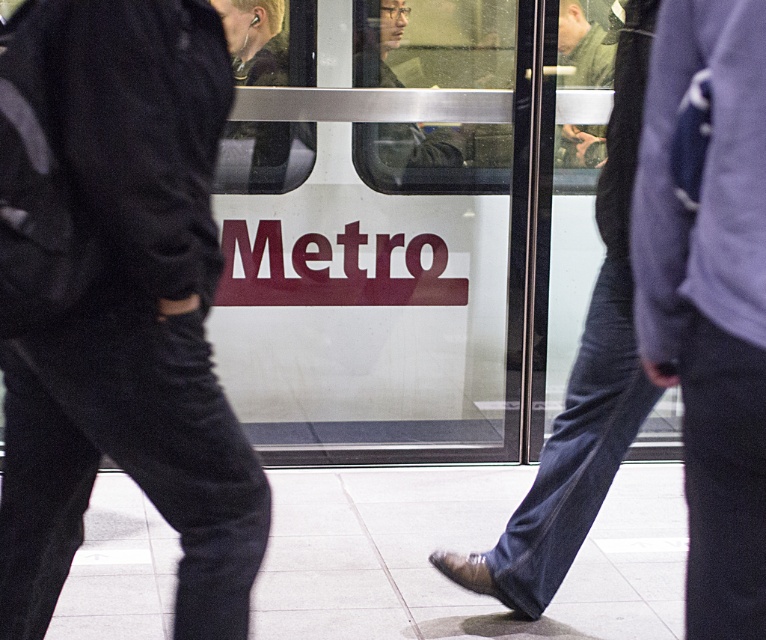
Does matte black jacket at center have a smaller size compared to green matte jacket at center?

Actually, matte black jacket at center might be larger than green matte jacket at center.

In the scene shown: Is matte black jacket at center positioned at the back of green matte jacket at center?

Yes, it is behind green matte jacket at center.

What do you see at coordinates (408, 156) in the screenshot? I see `matte black jacket at center` at bounding box center [408, 156].

Where is `matte black jacket at center`? The width and height of the screenshot is (766, 640). matte black jacket at center is located at coordinates (408, 156).

Between black matte pants at left and purple sweater at right, which one has more height?

black matte pants at left is taller.

Is black matte pants at left below purple sweater at right?

Yes.

Who is more forward, (30,483) or (763,624)?

Point (763,624)

You are a GUI agent. You are given a task and a screenshot of the screen. Output one action in this format:
    pyautogui.click(x=<x>, y=<y>)
    Task: Click on the black matte pants at left
    
    Given the screenshot: What is the action you would take?
    pyautogui.click(x=133, y=328)

Is purple sweater at right smaller than green matte jacket at center?

Incorrect, purple sweater at right is not smaller in size than green matte jacket at center.

Can you confirm if purple sweater at right is thinner than green matte jacket at center?

Correct, purple sweater at right's width is less than green matte jacket at center's.

Locate an element on the screen. The height and width of the screenshot is (640, 766). purple sweater at right is located at coordinates (709, 298).

Find the location of a particular element. The image size is (766, 640). purple sweater at right is located at coordinates (709, 298).